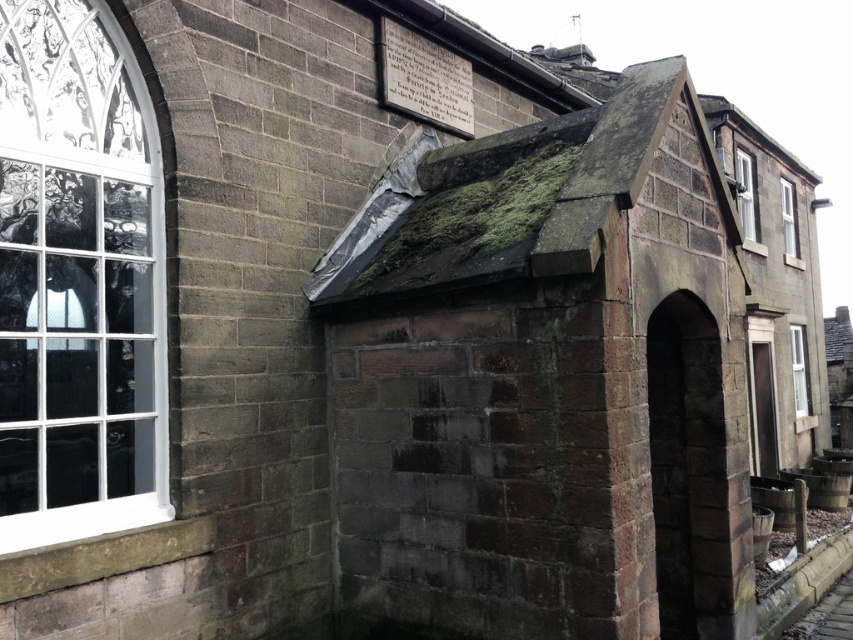
You are an architect inspecting a historic building. You notice the white glass window at left and the green mossy roof at upper center. Which of these two features has a narrower width?

The white glass window at left is thinner than the green mossy roof at upper center, so the white glass window at left has a narrower width.

You are an architect inspecting the building. You notice the green mossy roof at upper center and the clear glass window at upper right. Which of these two features has a larger surface area?

The green mossy roof at upper center is bigger than the clear glass window at upper right, so the green mossy roof at upper center has a larger surface area.